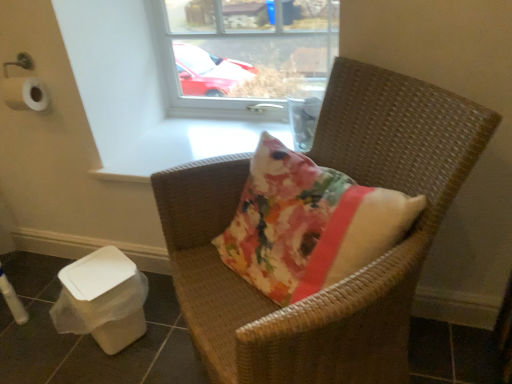
Question: Considering their positions, is white plastic potty at lower left located in front of or behind woven brown chair at center?

Choices:
 (A) front
 (B) behind

Answer: (B)

Question: Which is correct: white plastic potty at lower left is inside woven brown chair at center, or outside of it?

Choices:
 (A) outside
 (B) inside

Answer: (A)

Question: Estimate the real-world distances between objects in this image. Which object is closer to the transparent glass window at upper center?

Choices:
 (A) woven brown chair at center
 (B) white plastic potty at lower left

Answer: (A)

Question: Based on their relative distances, which object is farther from the white plastic potty at lower left?

Choices:
 (A) transparent glass window at upper center
 (B) woven brown chair at center

Answer: (A)